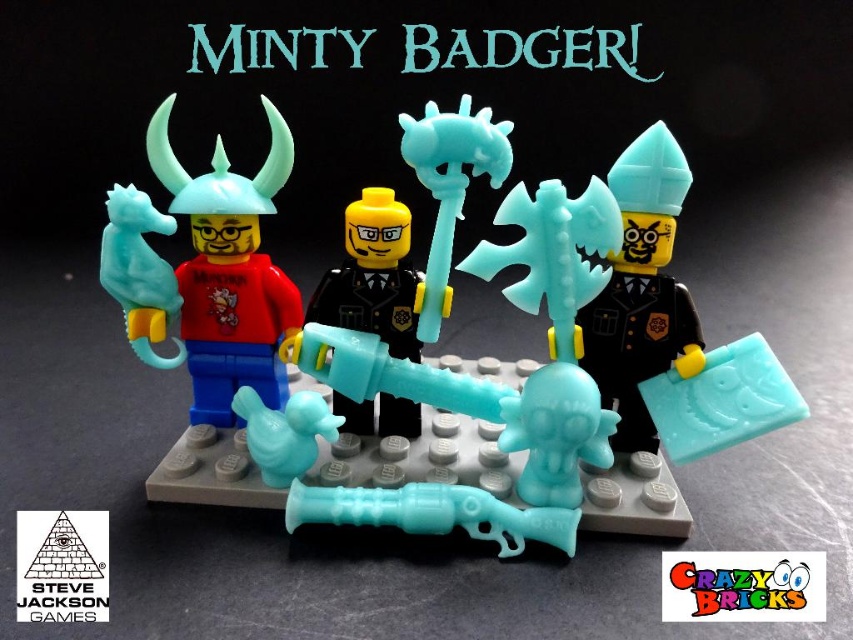
Question: Which of the following is the closest to the observer?

Choices:
 (A) (343, 301)
 (B) (291, 440)
 (C) (136, 212)

Answer: (B)

Question: Does matte plastic axe at center have a greater width compared to translucent blue plastic axe at center?

Choices:
 (A) no
 (B) yes

Answer: (B)

Question: Can you confirm if matte plastic axe at center is bigger than matte plastic minifigure at left?

Choices:
 (A) yes
 (B) no

Answer: (A)

Question: Is matte plastic minifigure at left further to the viewer compared to translucent blue plastic axe at center?

Choices:
 (A) no
 (B) yes

Answer: (A)

Question: Which object is the farthest from the matte plastic axe at center?

Choices:
 (A) translucent blue plastic axe at center
 (B) matte plastic minifigure at left

Answer: (A)

Question: Which object appears farthest from the camera in this image?

Choices:
 (A) matte plastic axe at center
 (B) matte plastic minifigure at left

Answer: (B)